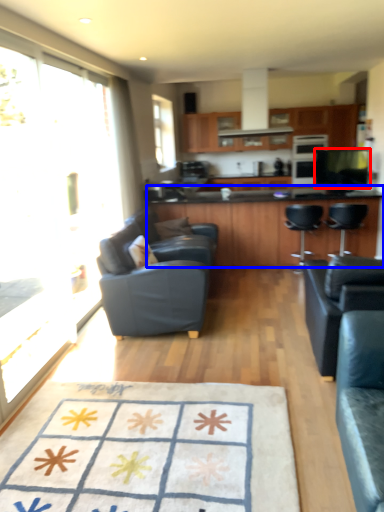
Question: Which of the following is the closest to the observer, appliance (highlighted by a red box) or countertop (highlighted by a blue box)?

Choices:
 (A) appliance
 (B) countertop

Answer: (B)